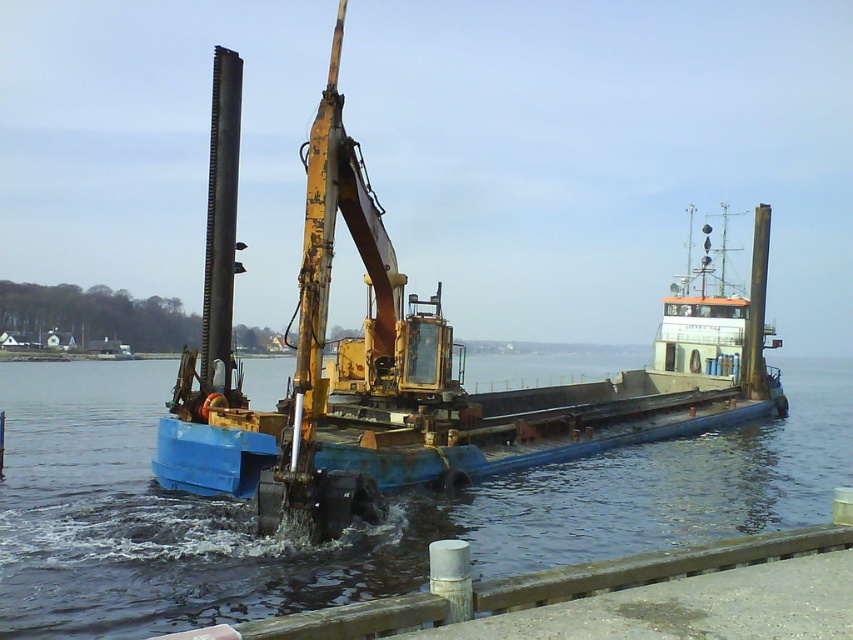
You are a crane operator on the blue painted steel barge at center. You need to lift a heavy object from the blue metallic water at center. Considering their widths, can you safely move the object without hitting the sides of the barge?

The blue metallic water at center is wider than the blue painted steel barge at center, so the barge is narrower. Therefore, you can safely move the object as long as it stays within the barge width, avoiding the water edges.

What are the coordinates of the blue metallic water at center in the image?

The coordinates of the blue metallic water at center are at point (354, 529).